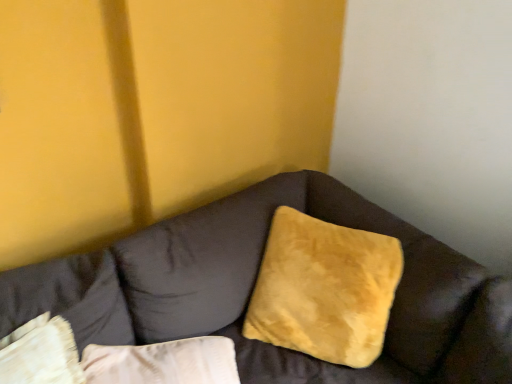
Question: From a real-world perspective, is velvet beige pillow at lower left, which is counted as the first pillow, starting from the left, on suede-like brown couch at center?

Choices:
 (A) yes
 (B) no

Answer: (A)

Question: Is velvet beige pillow at lower left, the 2th pillow viewed from the right, facing towards suede-like brown couch at center?

Choices:
 (A) yes
 (B) no

Answer: (A)

Question: Does velvet beige pillow at lower left, which is counted as the first pillow, starting from the left, have a lesser height compared to suede-like brown couch at center?

Choices:
 (A) no
 (B) yes

Answer: (B)

Question: From a real-world perspective, is velvet beige pillow at lower left, the 2th pillow viewed from the right, under suede-like brown couch at center?

Choices:
 (A) no
 (B) yes

Answer: (A)

Question: Can you see velvet beige pillow at lower left, the 2th pillow viewed from the right, touching suede-like brown couch at center?

Choices:
 (A) no
 (B) yes

Answer: (A)

Question: Is velvet beige pillow at lower left, the 2th pillow viewed from the right, wider than suede-like brown couch at center?

Choices:
 (A) no
 (B) yes

Answer: (A)

Question: Is velvet beige pillow at lower left, which is counted as the first pillow, starting from the left, not inside suede yellow pillow at center, positioned as the first pillow in right-to-left order?

Choices:
 (A) no
 (B) yes

Answer: (B)

Question: From a real-world perspective, is velvet beige pillow at lower left, the 2th pillow viewed from the right, positioned over suede yellow pillow at center, which ranks as the second pillow in left-to-right order, based on gravity?

Choices:
 (A) yes
 (B) no

Answer: (B)

Question: Does velvet beige pillow at lower left, the 2th pillow viewed from the right, appear on the right side of suede yellow pillow at center, which ranks as the second pillow in left-to-right order?

Choices:
 (A) no
 (B) yes

Answer: (A)

Question: Considering the relative sizes of velvet beige pillow at lower left, the 2th pillow viewed from the right, and suede yellow pillow at center, which ranks as the second pillow in left-to-right order, in the image provided, is velvet beige pillow at lower left, the 2th pillow viewed from the right, thinner than suede yellow pillow at center, which ranks as the second pillow in left-to-right order,?

Choices:
 (A) yes
 (B) no

Answer: (A)

Question: Can you confirm if velvet beige pillow at lower left, the 2th pillow viewed from the right, is shorter than suede yellow pillow at center, which ranks as the second pillow in left-to-right order?

Choices:
 (A) yes
 (B) no

Answer: (B)

Question: Is velvet beige pillow at lower left, the 2th pillow viewed from the right, positioned with its back to suede yellow pillow at center, which ranks as the second pillow in left-to-right order?

Choices:
 (A) no
 (B) yes

Answer: (A)

Question: Can you confirm if suede yellow pillow at center, positioned as the first pillow in right-to-left order, is wider than velvet beige pillow at lower left, the 2th pillow viewed from the right?

Choices:
 (A) yes
 (B) no

Answer: (A)